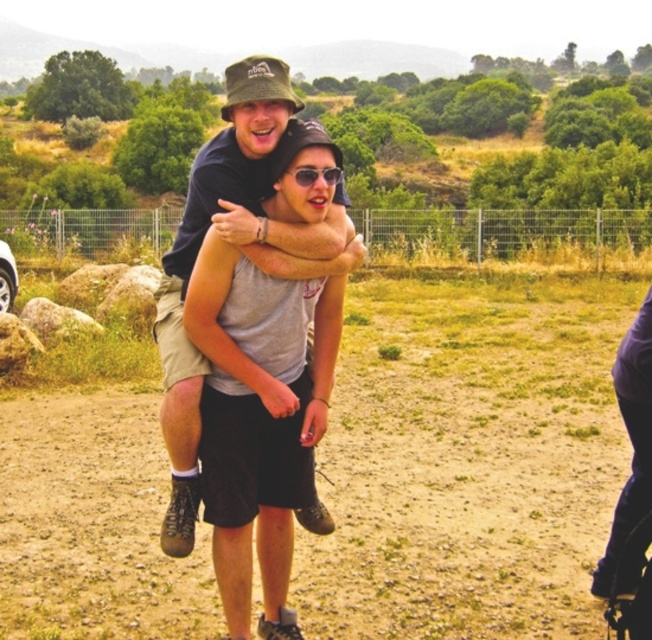
You are a photographer trying to capture the person in the center of the image. Which object, the matte black shirt at center or the sunglasses at center, should you focus on first if you want to ensure both are in the frame?

The matte black shirt at center is located below sunglasses at center, so you should focus on the sunglasses at center first to ensure both are in the frame.

You are a photographer planning to take a photo of the dull brown dirt at center and the sunglasses at center. Which object is closer to the camera?

The sunglasses at center are closer to the camera because the dull brown dirt at center is further away from the viewer.